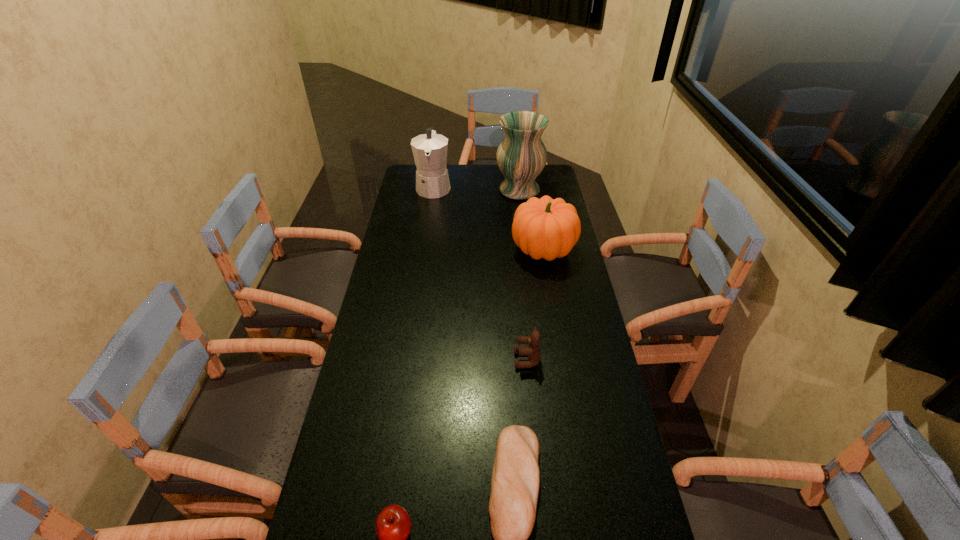
Identify the location of vase. The height and width of the screenshot is (540, 960). (521, 156).

You are a GUI agent. You are given a task and a screenshot of the screen. Output one action in this format:
    pyautogui.click(x=<x>, y=<y>)
    Task: Click on the coffeepot
    
    Given the screenshot: What is the action you would take?
    pyautogui.click(x=429, y=150)

At what (x,y) coordinates should I click in order to perform the action: click on pumpkin. Please return your answer as a coordinate pair (x, y). Looking at the image, I should click on (545, 228).

Identify the location of the fourth nearest object. point(545,228).

Where is `the third shortest object`? The image size is (960, 540). the third shortest object is located at coordinates (533, 351).

The width and height of the screenshot is (960, 540). I want to click on the third nearest object, so click(x=533, y=351).

Identify the location of vacant area situated on the back of the vase. This screenshot has height=540, width=960. (517, 173).

The height and width of the screenshot is (540, 960). Find the location of `free space located at the spout of the coffeepot`. free space located at the spout of the coffeepot is located at coordinates (423, 254).

Where is `free space located on the front of the pumpkin`? free space located on the front of the pumpkin is located at coordinates (554, 314).

At what (x,y) coordinates should I click in order to perform the action: click on vacant space situated on the face of the third shortest object. Please return your answer as a coordinate pair (x, y). Looking at the image, I should click on (394, 360).